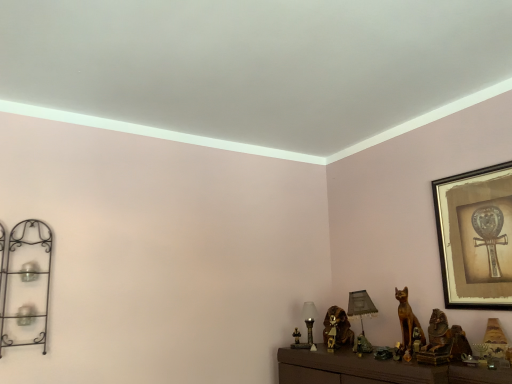
Question: Is matte glass table lamp at center, the 2th table lamp in the right-to-left sequence, bigger than golden wood cat at lower right, marked as the second animal in a left-to-right arrangement?

Choices:
 (A) yes
 (B) no

Answer: (B)

Question: From a real-world perspective, is matte glass table lamp at center, the 1th table lamp from the left, on top of golden wood cat at lower right, arranged as the second animal when viewed from the back?

Choices:
 (A) no
 (B) yes

Answer: (A)

Question: From a real-world perspective, is matte glass table lamp at center, the 1th table lamp from the left, beneath golden wood cat at lower right, marked as the second animal in a left-to-right arrangement?

Choices:
 (A) yes
 (B) no

Answer: (A)

Question: Does matte glass table lamp at center, the 2th table lamp in the right-to-left sequence, have a lesser height compared to golden wood cat at lower right, the first animal in the right-to-left sequence?

Choices:
 (A) yes
 (B) no

Answer: (A)

Question: From the image's perspective, is matte glass table lamp at center, the 1th table lamp from the left, on golden wood cat at lower right, the 1th animal from the front?

Choices:
 (A) no
 (B) yes

Answer: (A)

Question: In the image, is matte gray lampshade at center, the 2th table lamp viewed from the left, on the left side or the right side of golden wood cat at lower right, the 1th animal from the front?

Choices:
 (A) right
 (B) left

Answer: (B)

Question: Is point (357, 349) closer or farther from the camera than point (401, 314)?

Choices:
 (A) farther
 (B) closer

Answer: (A)

Question: From a real-world perspective, is matte gray lampshade at center, the 2th table lamp viewed from the left, positioned above or below golden wood cat at lower right, the first animal in the right-to-left sequence?

Choices:
 (A) above
 (B) below

Answer: (A)

Question: Choose the correct answer: Is matte gray lampshade at center, the first table lamp when ordered from right to left, inside golden wood cat at lower right, the first animal in the right-to-left sequence, or outside it?

Choices:
 (A) outside
 (B) inside

Answer: (A)

Question: Is gold-framed artwork at upper right bigger or smaller than black wrought iron shelf at left?

Choices:
 (A) small
 (B) big

Answer: (B)

Question: From the image's perspective, is gold-framed artwork at upper right located above or below black wrought iron shelf at left?

Choices:
 (A) above
 (B) below

Answer: (A)

Question: Is gold-framed artwork at upper right taller or shorter than black wrought iron shelf at left?

Choices:
 (A) short
 (B) tall

Answer: (B)

Question: From a real-world perspective, relative to black wrought iron shelf at left, is gold-framed artwork at upper right vertically above or below?

Choices:
 (A) below
 (B) above

Answer: (B)

Question: In terms of size, does black wrought iron shelf at left appear bigger or smaller than matte glass table lamp at center, the 1th table lamp from the left?

Choices:
 (A) small
 (B) big

Answer: (B)

Question: Visually, is black wrought iron shelf at left positioned to the left or to the right of matte glass table lamp at center, the 2th table lamp in the right-to-left sequence?

Choices:
 (A) right
 (B) left

Answer: (B)